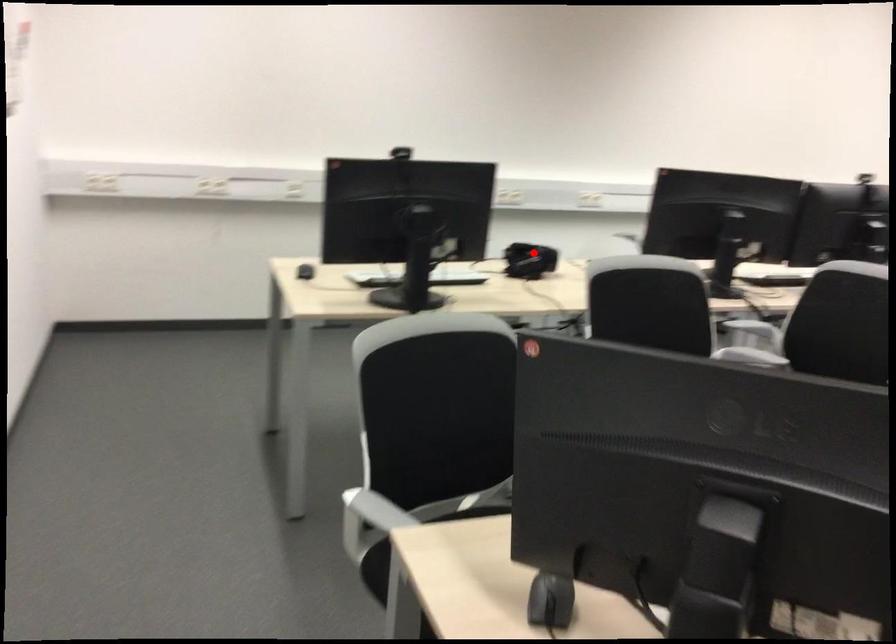
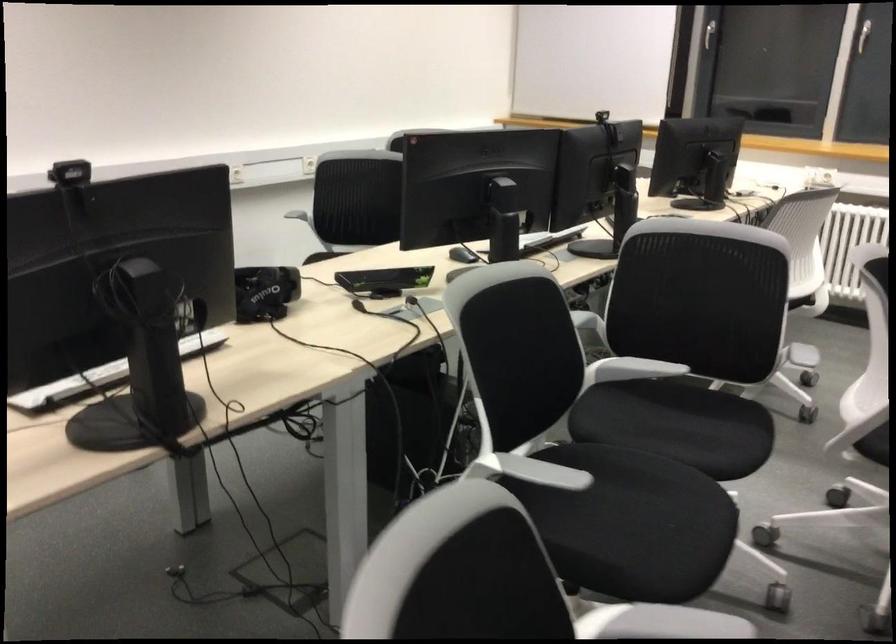
Question: I am providing you with two images of the same scene from different viewpoints. Given a red point in image1, look at the same physical point in image2. Is it:

Choices:
 (A) Closer to the viewpoint
 (B) Farther from the viewpoint

Answer: (A)